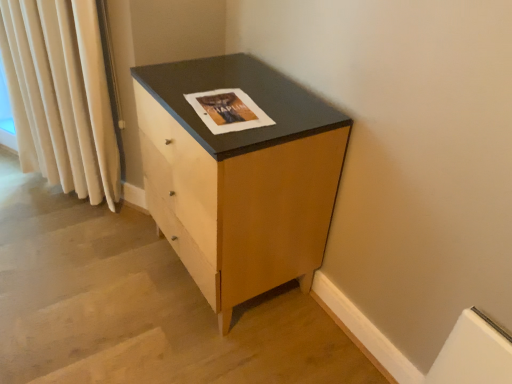
The height and width of the screenshot is (384, 512). What are the coordinates of `vacant space underneath cream velvet curtain at left (from a real-world perspective)` in the screenshot? It's located at (95, 211).